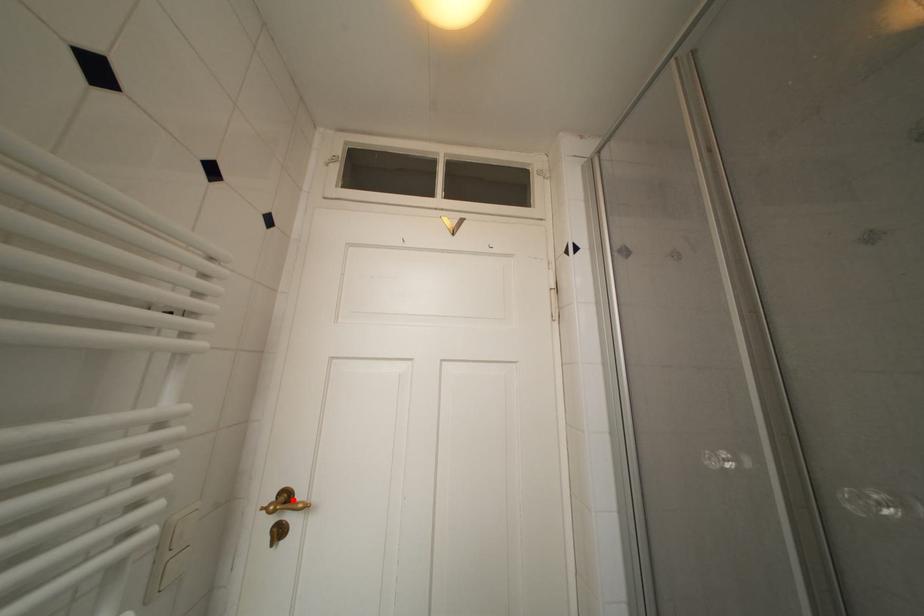
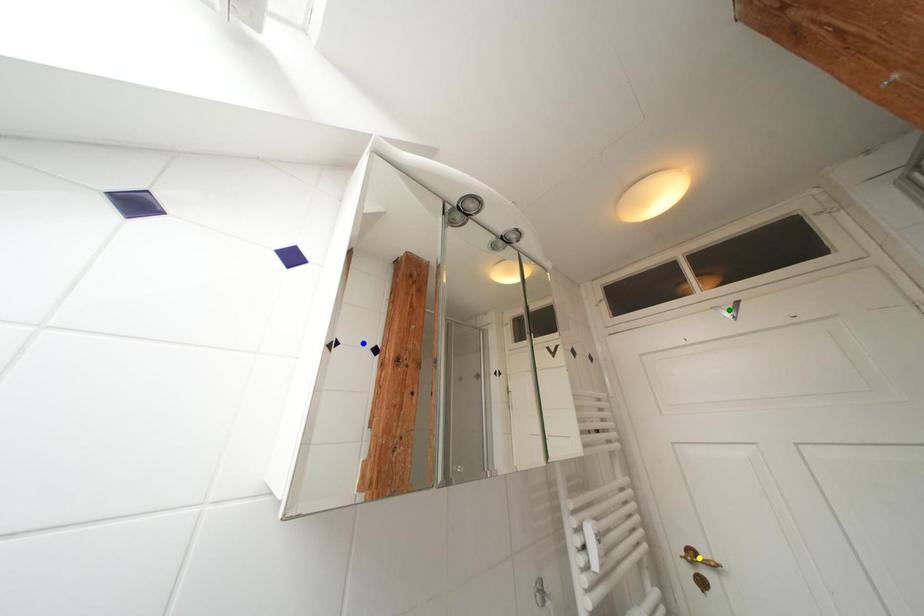
Question: I am providing you with two images of the same scene from different viewpoints. A red point is marked on the first image. You are given multiple points on the second image. Which mark in image 2 goes with the point in image 1?

Choices:
 (A) blue point
 (B) yellow point
 (C) green point

Answer: (B)